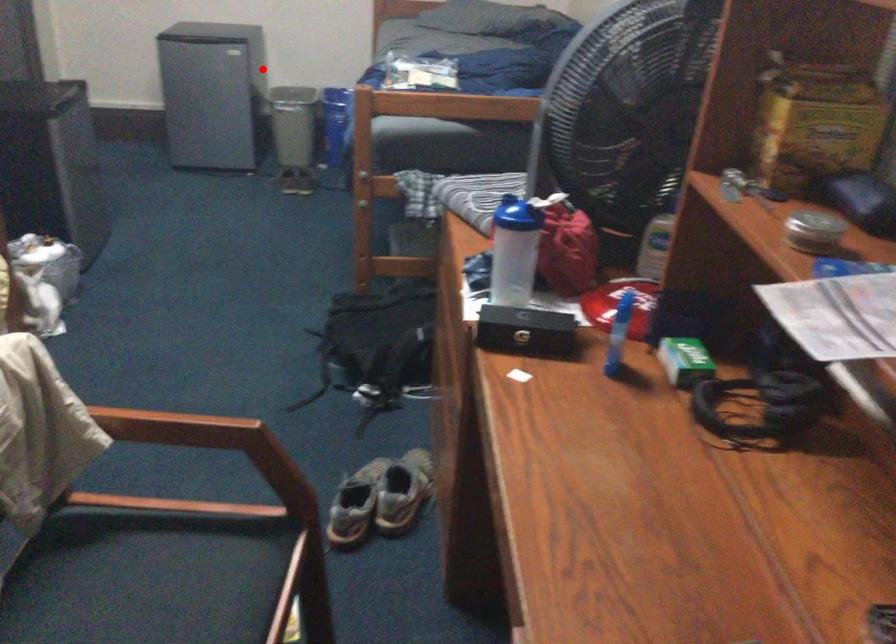
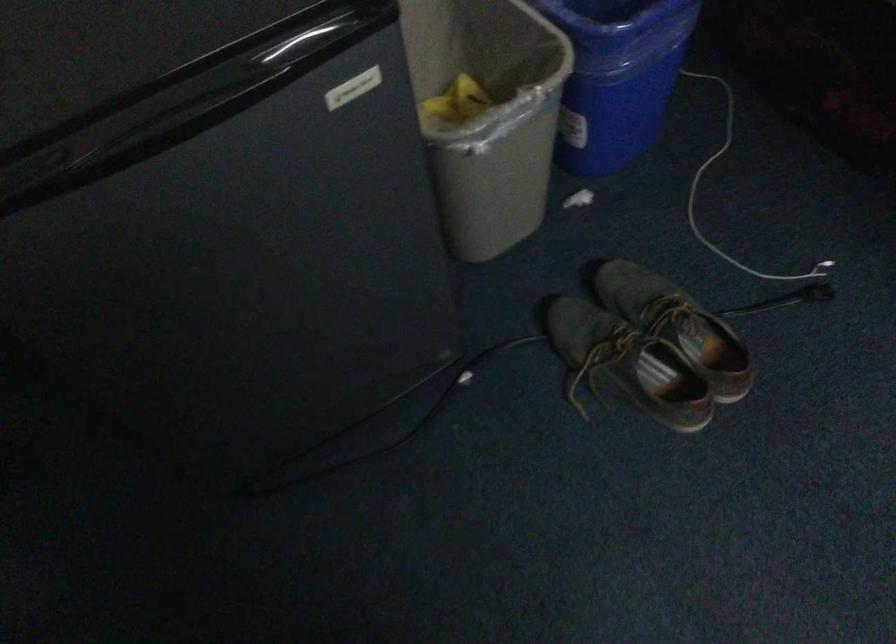
Question: I am providing you with two images of the same scene from different viewpoints. Given a red point in image1, look at the same physical point in image2. Is it:

Choices:
 (A) Closer to the viewpoint
 (B) Farther from the viewpoint

Answer: (A)